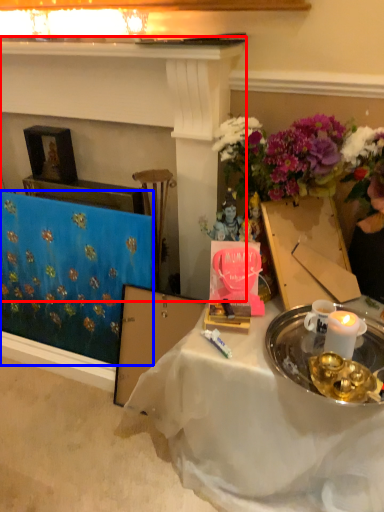
Question: Which point is further to the camera, fireplace (highlighted by a red box) or tablecloth (highlighted by a blue box)?

Choices:
 (A) fireplace
 (B) tablecloth

Answer: (B)